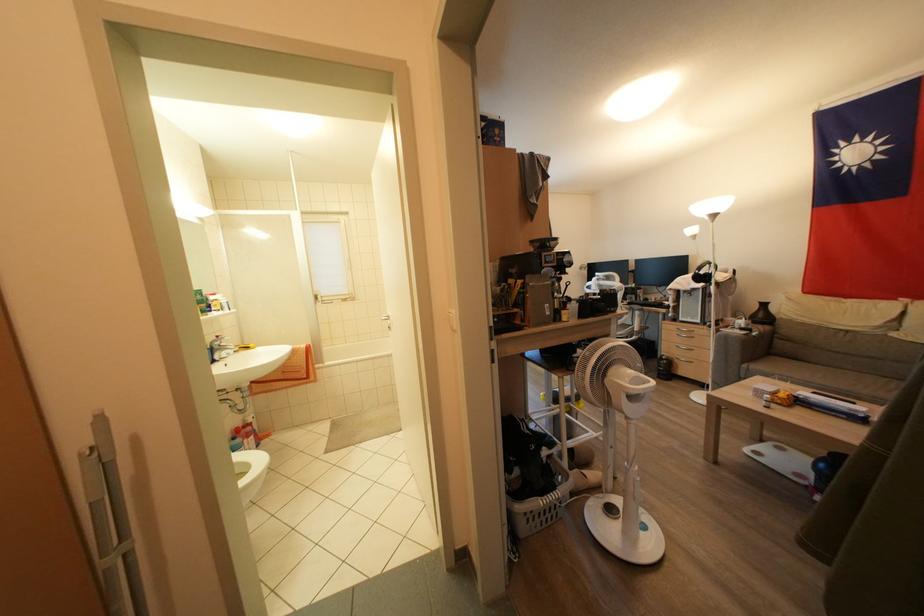
Image resolution: width=924 pixels, height=616 pixels. I want to click on door handle, so click(386, 318).